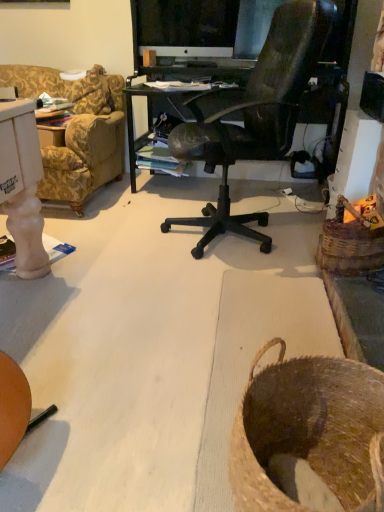
Question: Is white glossy computer monitor at upper center facing away from brown woven basket at lower right, acting as the 1th basket starting from the front?

Choices:
 (A) yes
 (B) no

Answer: (B)

Question: Considering the relative sizes of white glossy computer monitor at upper center and brown woven basket at lower right, marked as the 1th basket in a bottom-to-top arrangement, in the image provided, is white glossy computer monitor at upper center wider than brown woven basket at lower right, marked as the 1th basket in a bottom-to-top arrangement,?

Choices:
 (A) no
 (B) yes

Answer: (A)

Question: From the image's perspective, is white glossy computer monitor at upper center under brown woven basket at lower right, the second basket from the back?

Choices:
 (A) yes
 (B) no

Answer: (B)

Question: From the image's perspective, does white glossy computer monitor at upper center appear higher than brown woven basket at lower right, the second basket from the back?

Choices:
 (A) no
 (B) yes

Answer: (B)

Question: Does white glossy computer monitor at upper center have a greater height compared to brown woven basket at lower right, acting as the 2th basket starting from the top?

Choices:
 (A) yes
 (B) no

Answer: (A)

Question: Considering the relative positions of white glossy computer monitor at upper center and woven brown basket at right, which appears as the 2th basket when viewed from the front, in the image provided, is white glossy computer monitor at upper center to the left or to the right of woven brown basket at right, which appears as the 2th basket when viewed from the front,?

Choices:
 (A) left
 (B) right

Answer: (A)

Question: From a real-world perspective, is white glossy computer monitor at upper center positioned above or below woven brown basket at right, which is counted as the second basket, starting from the left?

Choices:
 (A) above
 (B) below

Answer: (A)

Question: Based on their sizes in the image, would you say white glossy computer monitor at upper center is bigger or smaller than woven brown basket at right, the first basket viewed from the back?

Choices:
 (A) big
 (B) small

Answer: (A)

Question: Do you think white glossy computer monitor at upper center is within woven brown basket at right, positioned as the 2th basket in bottom-to-top order, or outside of it?

Choices:
 (A) outside
 (B) inside

Answer: (A)

Question: Which is correct: woven brown basket at right, the 1th basket from the top, is inside brown woven basket at lower right, acting as the 1th basket starting from the front, or outside of it?

Choices:
 (A) outside
 (B) inside

Answer: (A)

Question: In the image, is woven brown basket at right, which is counted as the first basket, starting from the right, on the left side or the right side of brown woven basket at lower right, acting as the 2th basket starting from the top?

Choices:
 (A) right
 (B) left

Answer: (A)

Question: From the image's perspective, is woven brown basket at right, which appears as the 2th basket when viewed from the front, positioned above or below brown woven basket at lower right, acting as the 1th basket starting from the front?

Choices:
 (A) below
 (B) above

Answer: (B)

Question: Does point (342, 197) appear closer or farther from the camera than point (263, 389)?

Choices:
 (A) closer
 (B) farther

Answer: (B)

Question: Considering the positions of brown woven basket at lower right, acting as the 1th basket starting from the front, and white glossy computer monitor at upper center in the image, is brown woven basket at lower right, acting as the 1th basket starting from the front, wider or thinner than white glossy computer monitor at upper center?

Choices:
 (A) wide
 (B) thin

Answer: (A)

Question: In terms of height, does brown woven basket at lower right, marked as the 1th basket in a bottom-to-top arrangement, look taller or shorter compared to white glossy computer monitor at upper center?

Choices:
 (A) short
 (B) tall

Answer: (A)